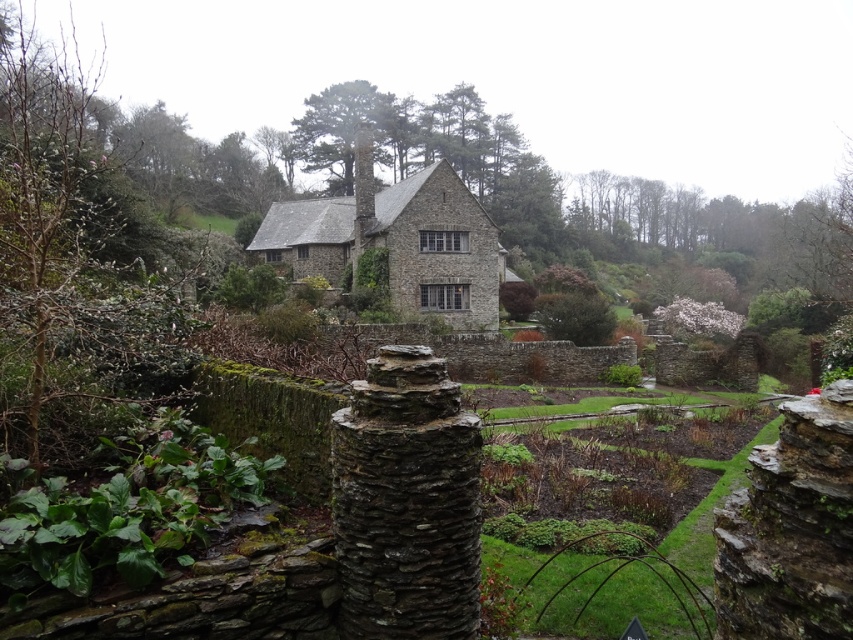
Question: Which point is farther from the camera taking this photo?

Choices:
 (A) (450, 440)
 (B) (408, 248)

Answer: (B)

Question: Is rustic stone pillar at center behind stone cottage at center?

Choices:
 (A) yes
 (B) no

Answer: (B)

Question: Does rustic stone pillar at center lie behind stone cottage at center?

Choices:
 (A) yes
 (B) no

Answer: (B)

Question: Which object is closer to the camera taking this photo?

Choices:
 (A) rustic stone pillar at center
 (B) stone cottage at center

Answer: (A)

Question: Does rustic stone pillar at center have a larger size compared to stone cottage at center?

Choices:
 (A) yes
 (B) no

Answer: (B)